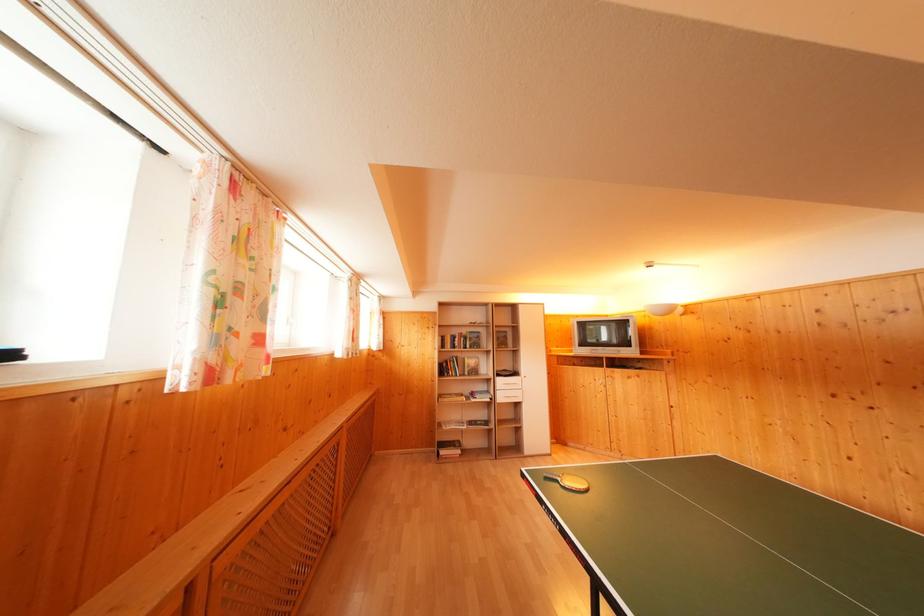
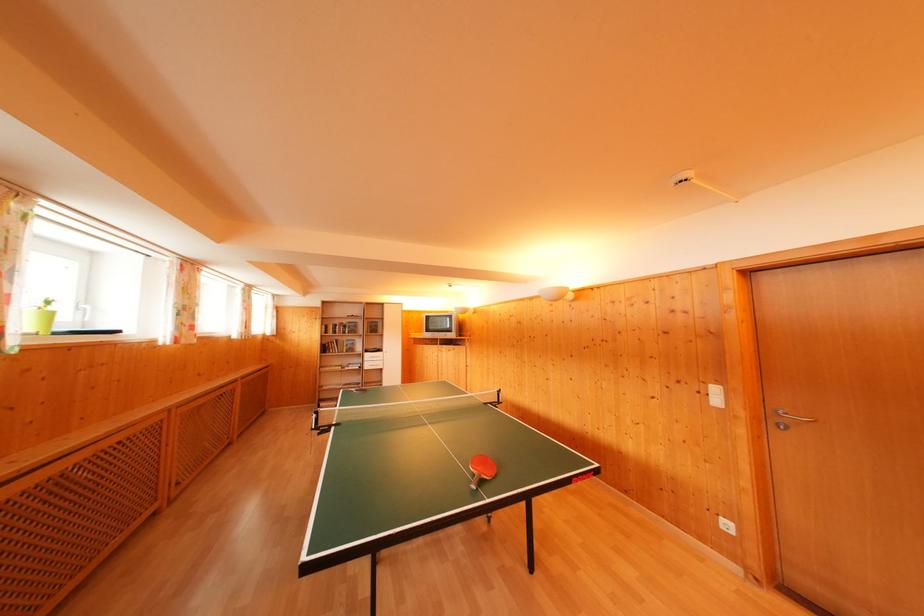
Find the pixel in the second image that matches point (505, 386) in the first image.

(371, 360)